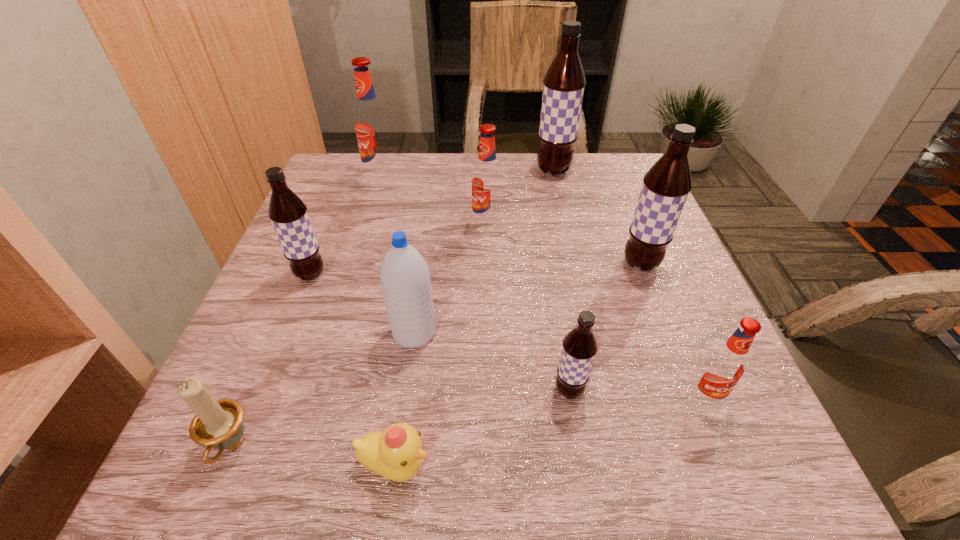
Identify the location of free area in between the second biggest brown root beer and the leftmost brown root beer. (475, 269).

Find the location of a particular element. The width and height of the screenshot is (960, 540). unoccupied position between the nearest brown root beer and the second smallest red root beer is located at coordinates (528, 308).

The height and width of the screenshot is (540, 960). I want to click on vacant region between the second red root beer from left to right and the smallest red root beer, so click(596, 311).

Locate an element on the screen. This screenshot has height=540, width=960. empty location between the candle_holder and the nearest red root beer is located at coordinates (468, 422).

Locate an element on the screen. This screenshot has width=960, height=540. free space that is in between the rightmost brown root beer and the fifth object from right to left is located at coordinates (564, 245).

Locate an element on the screen. The image size is (960, 540). free space between the candle_holder and the third smallest brown root beer is located at coordinates (436, 356).

Point out which object is positioned as the ninth nearest to the smallest brown root beer. Please provide its 2D coordinates. Your answer should be formatted as a tuple, i.e. [(x, y)], where the tuple contains the x and y coordinates of a point satisfying the conditions above.

[(371, 124)]

This screenshot has height=540, width=960. Identify the location of object that is the fifth closest to the water bottle. (486, 179).

This screenshot has width=960, height=540. Find the location of `root beer object that ranks as the sixth closest to the yellow duckling`. root beer object that ranks as the sixth closest to the yellow duckling is located at coordinates (371, 124).

Identify which root beer is the fourth closest to the farthest brown root beer. Please provide its 2D coordinates. Your answer should be formatted as a tuple, i.e. [(x, y)], where the tuple contains the x and y coordinates of a point satisfying the conditions above.

[(288, 213)]